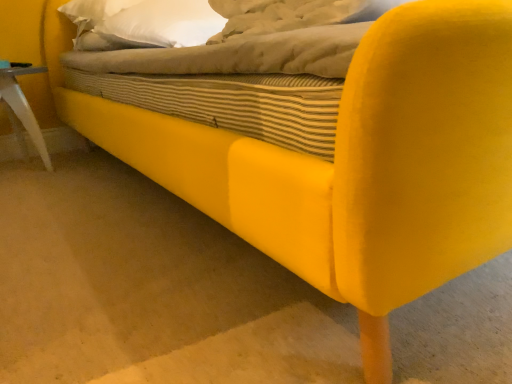
Question: Do you think white plastic side table at lower left is within white soft pillow at upper center, or outside of it?

Choices:
 (A) inside
 (B) outside

Answer: (B)

Question: In terms of size, does white plastic side table at lower left appear bigger or smaller than white soft pillow at upper center?

Choices:
 (A) small
 (B) big

Answer: (A)

Question: In terms of width, does white plastic side table at lower left look wider or thinner when compared to white soft pillow at upper center?

Choices:
 (A) wide
 (B) thin

Answer: (B)

Question: Is white soft pillow at upper center to the left or to the right of white plastic side table at lower left in the image?

Choices:
 (A) left
 (B) right

Answer: (B)

Question: In terms of height, does white soft pillow at upper center look taller or shorter compared to white plastic side table at lower left?

Choices:
 (A) tall
 (B) short

Answer: (B)

Question: Considering the positions of white soft pillow at upper center and white plastic side table at lower left in the image, is white soft pillow at upper center bigger or smaller than white plastic side table at lower left?

Choices:
 (A) small
 (B) big

Answer: (B)

Question: Is white soft pillow at upper center in front of or behind white plastic side table at lower left in the image?

Choices:
 (A) front
 (B) behind

Answer: (A)